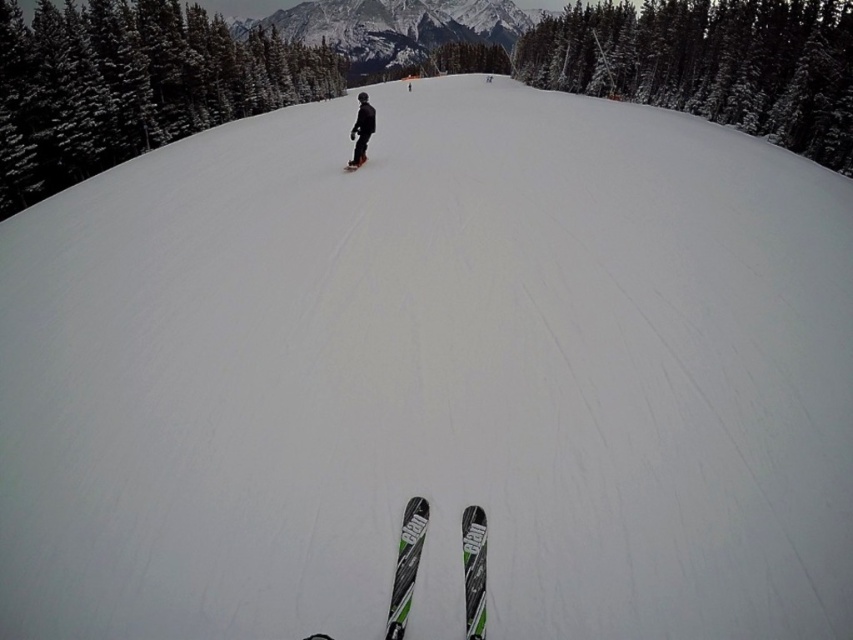
You are a photographer trying to capture a clear shot of the green matte skis at center and the black matte snowboarder at center. Since you want both subjects to be in focus, which object should you focus on first to ensure the shallow depth of field captures both properly?

The green matte skis at center is thinner than the black matte snowboarder at center. To ensure both are in focus with a shallow depth of field, focus on the black matte snowboarder at center first as it is larger and closer to the camera, allowing the depth of field to cover both subjects effectively.

You are a skier looking at the snowy granite mountain at upper center and the green matte skis at center. Which object appears larger in the scene?

The snowy granite mountain at upper center appears larger than the green matte skis at center.

You are a photographer trying to capture the snowy evergreen tree at upper right and the black matte snowboard at center in the same frame. Which object will appear larger in your photo?

The snowy evergreen tree at upper right will appear larger in the photo because it is much taller than the black matte snowboard at center.